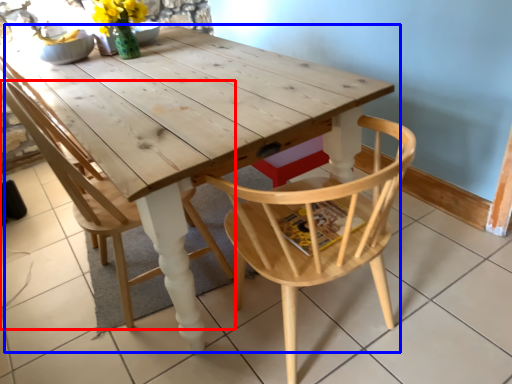
Question: Which object appears closest to the camera in this image, chair (highlighted by a red box) or table (highlighted by a blue box)?

Choices:
 (A) chair
 (B) table

Answer: (B)